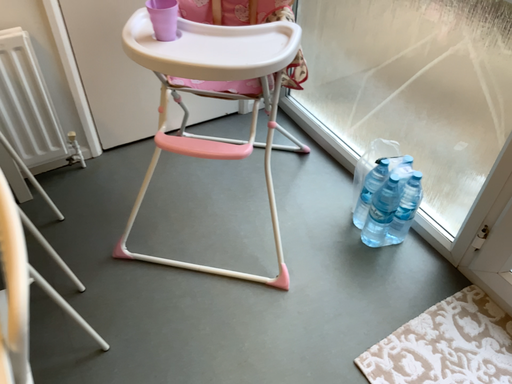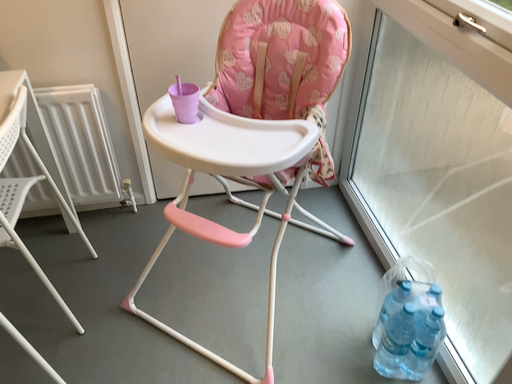
Question: How did the camera likely rotate when shooting the video?

Choices:
 (A) rotated upward
 (B) rotated downward

Answer: (A)